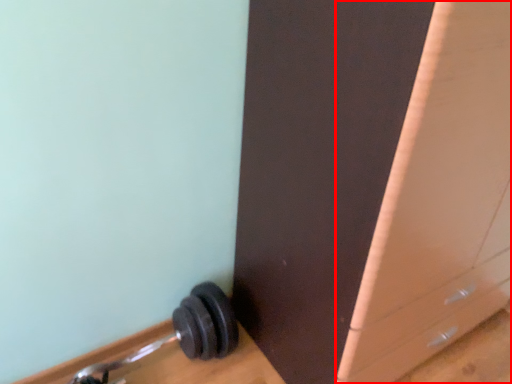
Question: From the image's perspective, considering the relative positions of file cabinet (annotated by the red box) and dumbbell in the image provided, where is file cabinet (annotated by the red box) located with respect to the staircase?

Choices:
 (A) above
 (B) below

Answer: (A)